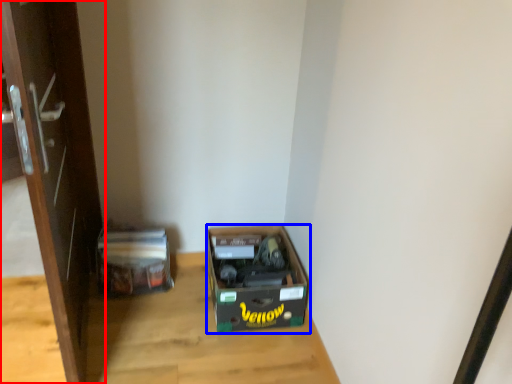
Question: Which object appears farthest to the camera in this image, door (highlighted by a red box) or box (highlighted by a blue box)?

Choices:
 (A) door
 (B) box

Answer: (B)